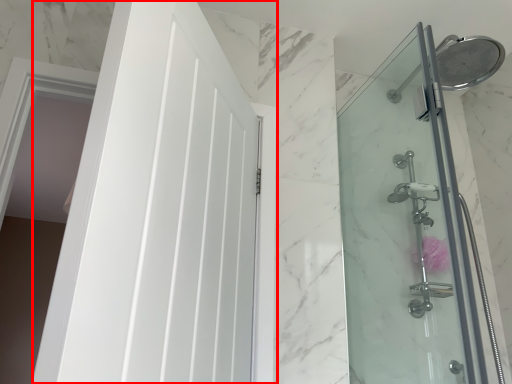
Question: Observing the image, what is the correct spatial positioning of door (annotated by the red box) in reference to screen door?

Choices:
 (A) right
 (B) left

Answer: (B)